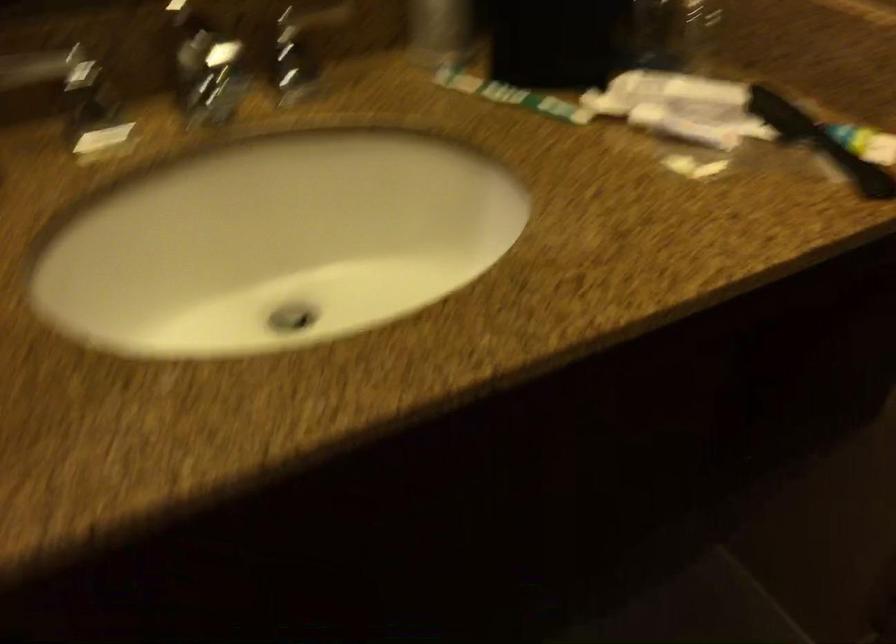
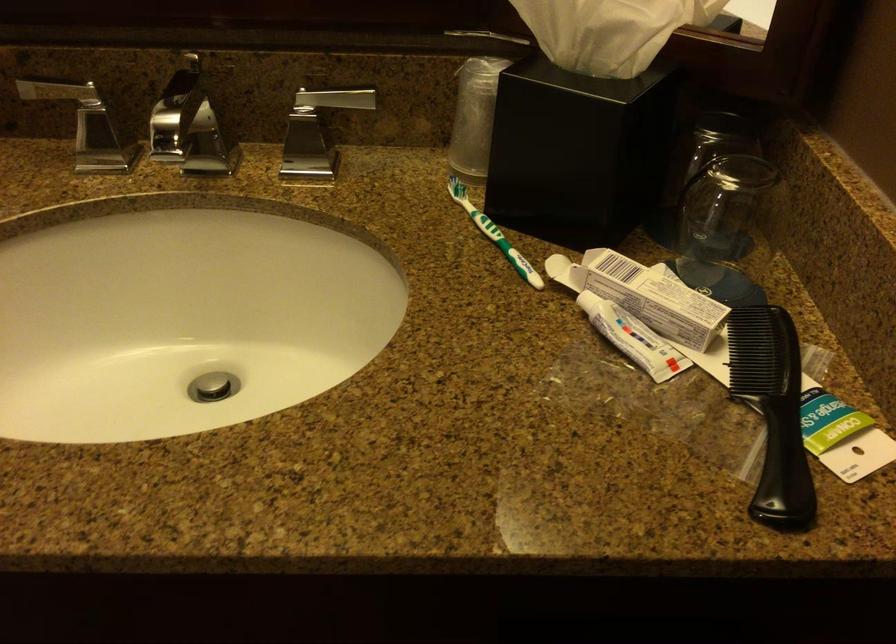
Find the pixel in the second image that matches point (520, 91) in the first image.

(494, 234)